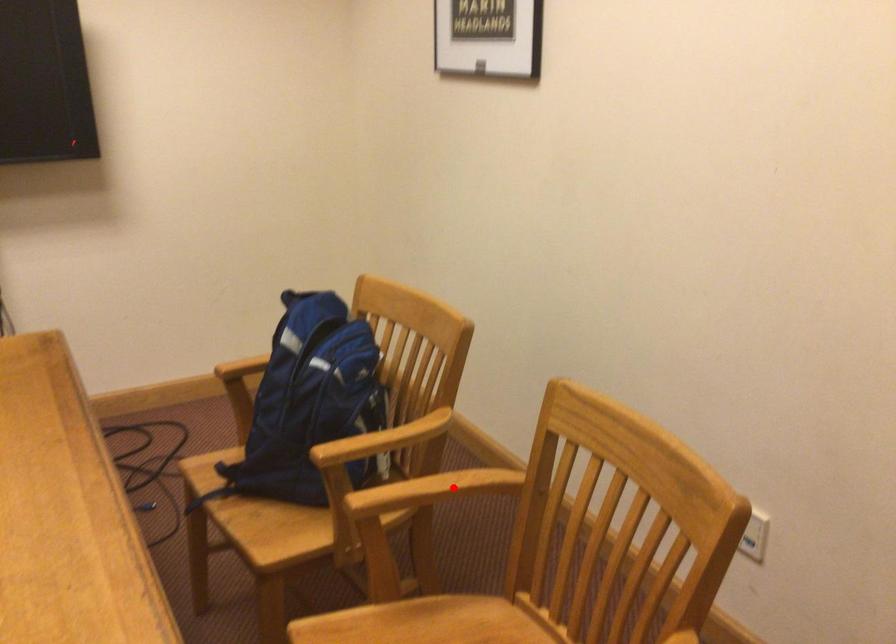
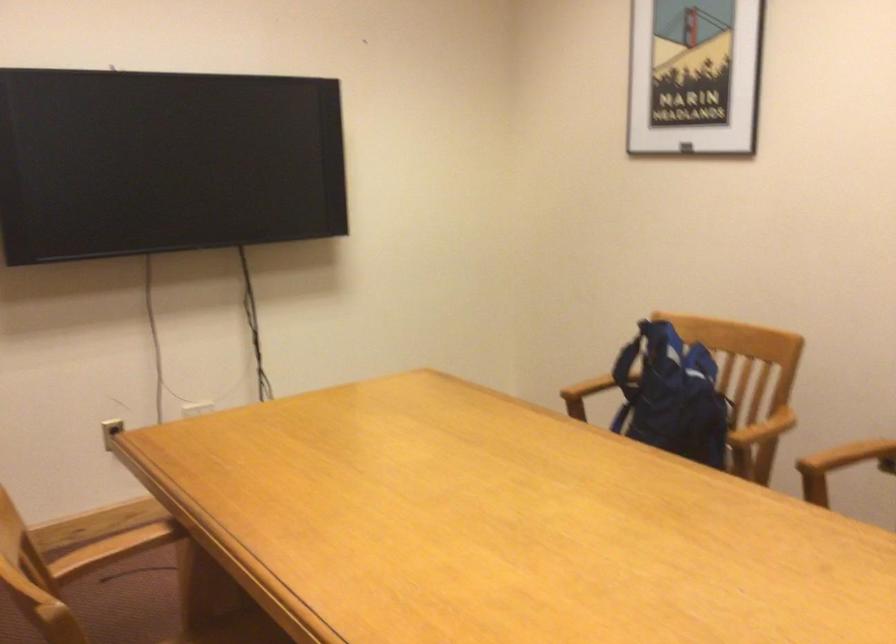
Where in the second image is the point corresponding to the highlighted location from the first image?

(849, 456)